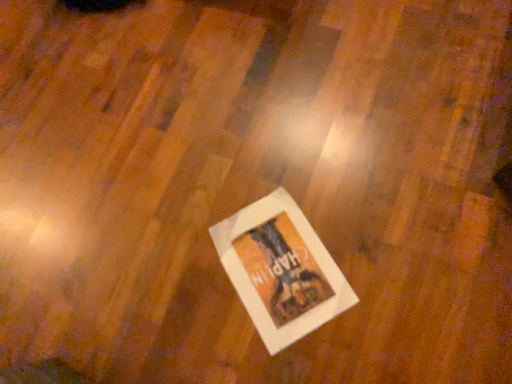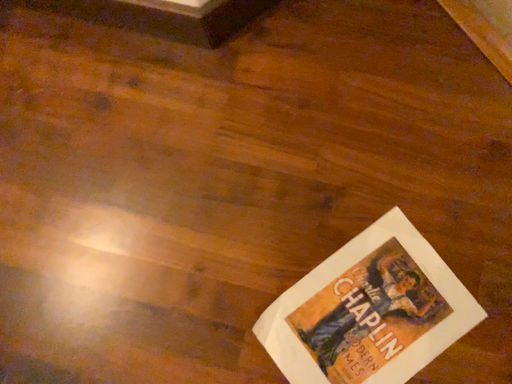
Question: Which way did the camera rotate in the video?

Choices:
 (A) rotated downward
 (B) rotated upward

Answer: (B)